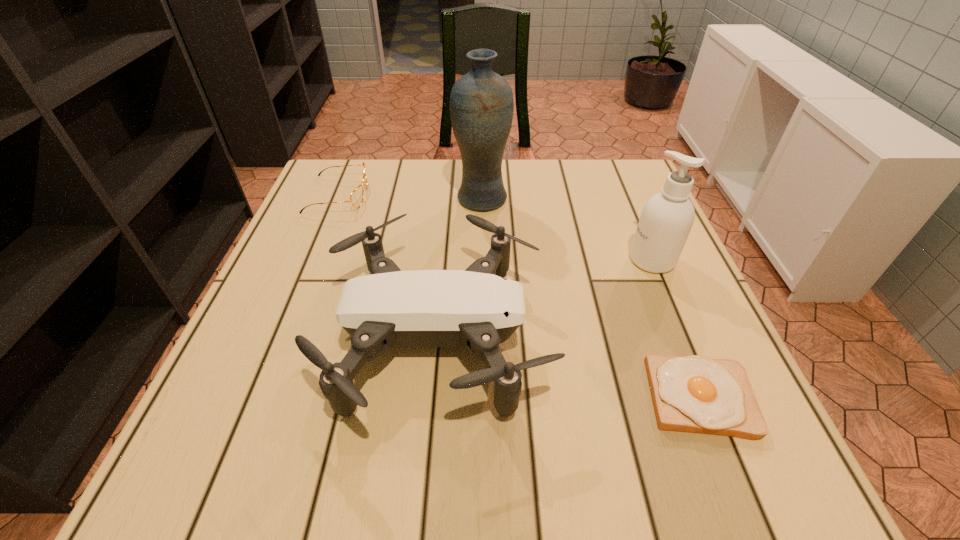
You are a GUI agent. You are given a task and a screenshot of the screen. Output one action in this format:
    pyautogui.click(x=<x>, y=<y>)
    Task: Click on the unoccupied position between the drone and the fourth shortest object
    This screenshot has height=540, width=960.
    Given the screenshot: What is the action you would take?
    pyautogui.click(x=545, y=299)

Where is `vacant space that's between the tallest object and the drone`? The image size is (960, 540). vacant space that's between the tallest object and the drone is located at coordinates (460, 268).

I want to click on free space that is in between the toast and the vase, so click(590, 298).

Find the location of a particular element. The height and width of the screenshot is (540, 960). free space between the third tallest object and the shortest object is located at coordinates (569, 367).

At what (x,y) coordinates should I click in order to perform the action: click on empty space between the tallest object and the second shortest object. Please return your answer as a coordinate pair (x, y). This screenshot has width=960, height=540. Looking at the image, I should click on (410, 197).

The image size is (960, 540). What are the coordinates of `the third closest object to the third shortest object` in the screenshot? It's located at (481, 102).

In order to click on object that stands as the fourth closest to the leftmost object in this screenshot , I will do `click(695, 394)`.

This screenshot has height=540, width=960. Identify the location of free spot that satisfies the following two spatial constraints: 1. on the front-facing side of the leftmost object; 2. on the left side of the shortest object. (255, 397).

Where is `vacant region that satisfies the following two spatial constraints: 1. on the back side of the shortest object; 2. on the camera side of the drone`? vacant region that satisfies the following two spatial constraints: 1. on the back side of the shortest object; 2. on the camera side of the drone is located at coordinates (676, 338).

Locate an element on the screen. This screenshot has height=540, width=960. vacant space that satisfies the following two spatial constraints: 1. on the front-facing side of the leftmost object; 2. on the left side of the vase is located at coordinates (337, 199).